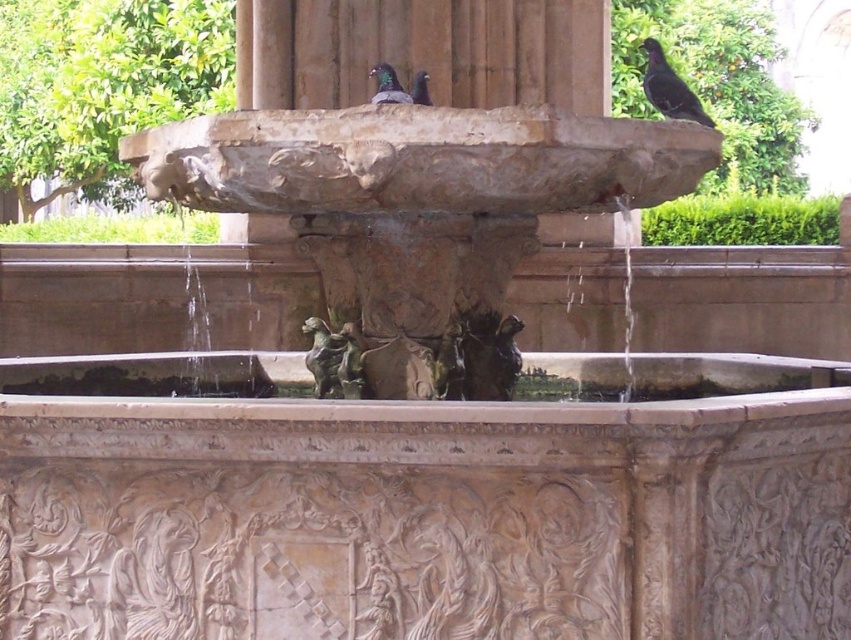
Question: Is shiny black bird at upper right wider than matte black pigeon at upper center?

Choices:
 (A) no
 (B) yes

Answer: (B)

Question: Which of the following is the farthest from the observer?

Choices:
 (A) shiny dark gray pigeon at upper center
 (B) shiny black bird at upper right
 (C) matte black pigeon at upper center
 (D) brown stone pillar at center

Answer: (D)

Question: Which point is closer to the camera?

Choices:
 (A) (421, 86)
 (B) (250, 32)
 (C) (387, 92)

Answer: (C)

Question: Can you confirm if brown stone pillar at center is positioned above shiny dark gray pigeon at upper center?

Choices:
 (A) yes
 (B) no

Answer: (A)

Question: Is shiny black bird at upper right below matte black pigeon at upper center?

Choices:
 (A) no
 (B) yes

Answer: (A)

Question: Which point is farther to the camera?

Choices:
 (A) [x=423, y=84]
 (B) [x=390, y=70]
 (C) [x=512, y=61]

Answer: (C)